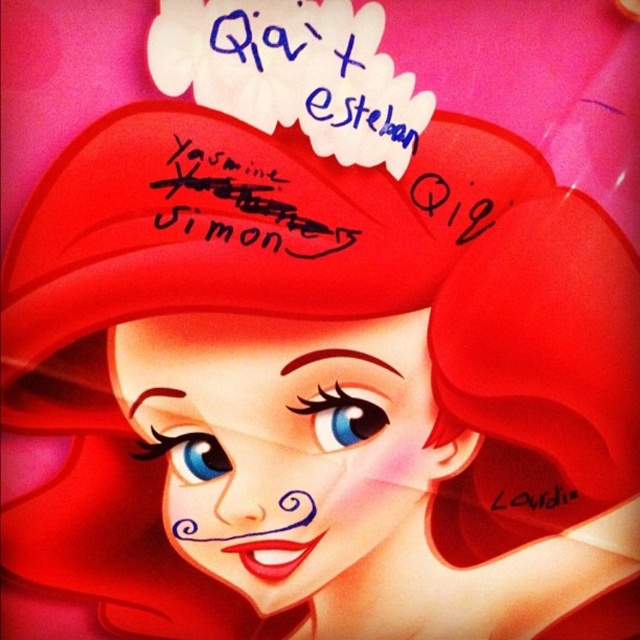
Does blue ink signature at upper center have a lesser height compared to black ink signature at center?

In fact, blue ink signature at upper center may be taller than black ink signature at center.

Does blue ink signature at upper center have a lesser width compared to black ink signature at center?

Incorrect, blue ink signature at upper center's width is not less than black ink signature at center's.

Does point (358, 22) come closer to viewer compared to point (356, 230)?

That is True.

The width and height of the screenshot is (640, 640). I want to click on blue ink signature at upper center, so click(x=310, y=77).

Is point (365, 532) less distant than point (346, 241)?

No.

Does point (358, 346) come behind point (220, 180)?

Yes, it is behind point (220, 180).

Locate an element on the screen. The width and height of the screenshot is (640, 640). matte red hair at center is located at coordinates (280, 440).

In the scene shown: Does matte red hair at center have a smaller size compared to blue ink signature at upper center?

No, matte red hair at center is not smaller than blue ink signature at upper center.

Can you confirm if matte red hair at center is positioned above blue ink signature at upper center?

No, matte red hair at center is not above blue ink signature at upper center.

Which is behind, point (316, 522) or point (356, 49)?

The point (316, 522) is more distant.

At what (x,y) coordinates should I click in order to perform the action: click on matte red hair at center. Please return your answer as a coordinate pair (x, y). The width and height of the screenshot is (640, 640). Looking at the image, I should click on (280, 440).